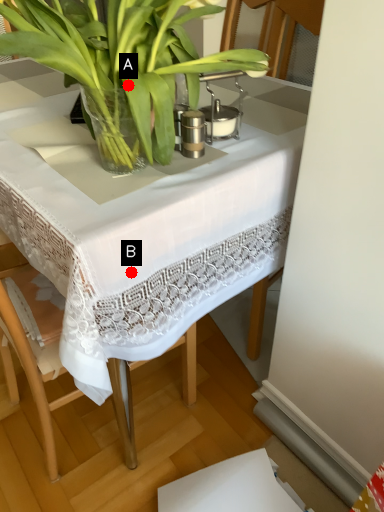
Question: Two points are circled on the image, labeled by A and B beside each circle. Among these points, which one is farthest from the camera?

Choices:
 (A) A is further
 (B) B is further

Answer: (A)